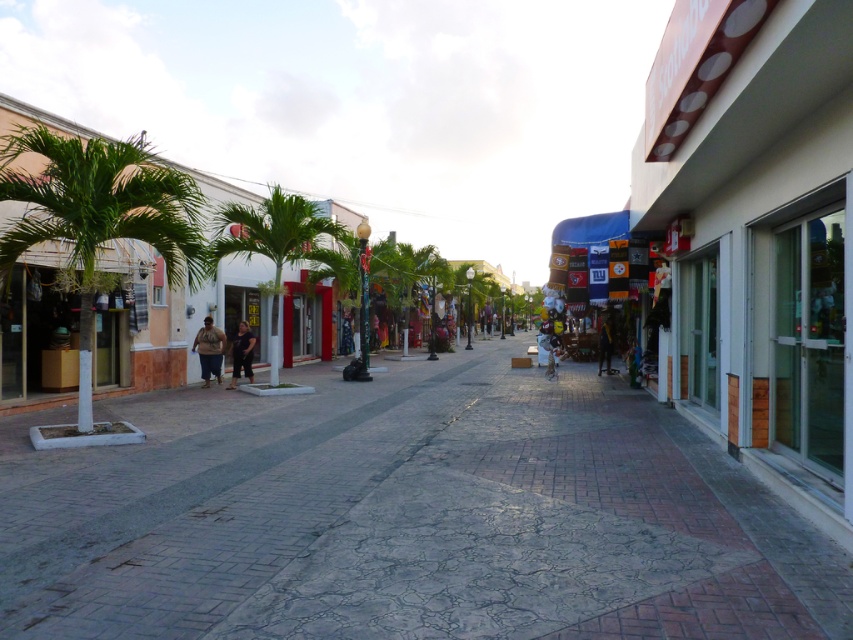
You are a person trying to decide whether to wear the brown fuzzy jacket at center and dark blue jeans at center for a walk in this tropical location. Considering the jacket is larger than the jeans, would the jacket provide enough coverage against the sun?

The brown fuzzy jacket at center is larger in size than dark blue jeans at center, but the jacket is only covering the upper body. Since the scene is in a tropical location with warm weather, the jacket may not provide sufficient sun coverage for the entire body, especially the legs which are covered by the dark blue jeans at center. Consider adding a hat or sunscreen for better protection.

You are a photographer standing in the middle of the tropical street scene. You notice a person wearing a brown fuzzy jacket at center and dark blue jeans at center. Which piece of clothing is closer to you?

The brown fuzzy jacket at center is closer to you because it is in front of the dark blue jeans at center.